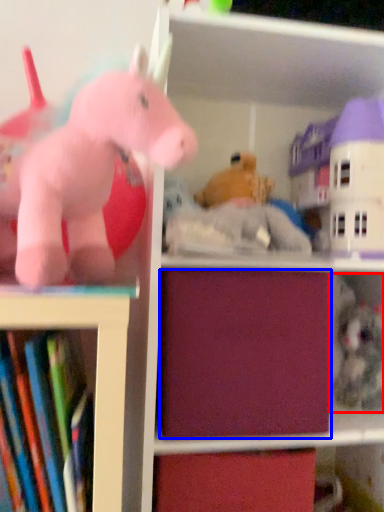
Question: Which point is further to the camera, toy (highlighted by a red box) or drawer (highlighted by a blue box)?

Choices:
 (A) toy
 (B) drawer

Answer: (A)